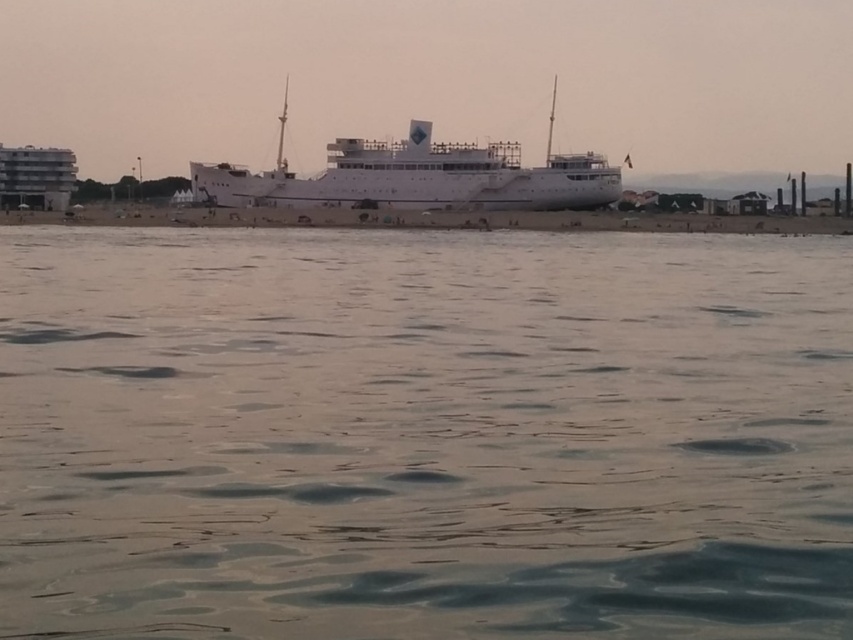
You are a photographer trying to capture the white glossy ship at center and the clear water at center in a single shot. Based on their positions, which object should you focus on first to ensure both are in frame?

The white glossy ship at center is on the left side of the clear water at center, so you should focus on the white glossy ship at center first to ensure both objects are included in the frame.